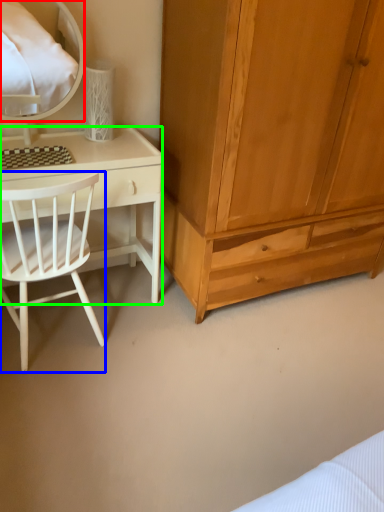
Question: Estimate the real-world distances between objects in this image. Which object is farther from mirror (highlighted by a red box), chair (highlighted by a blue box) or desk (highlighted by a green box)?

Choices:
 (A) chair
 (B) desk

Answer: (A)